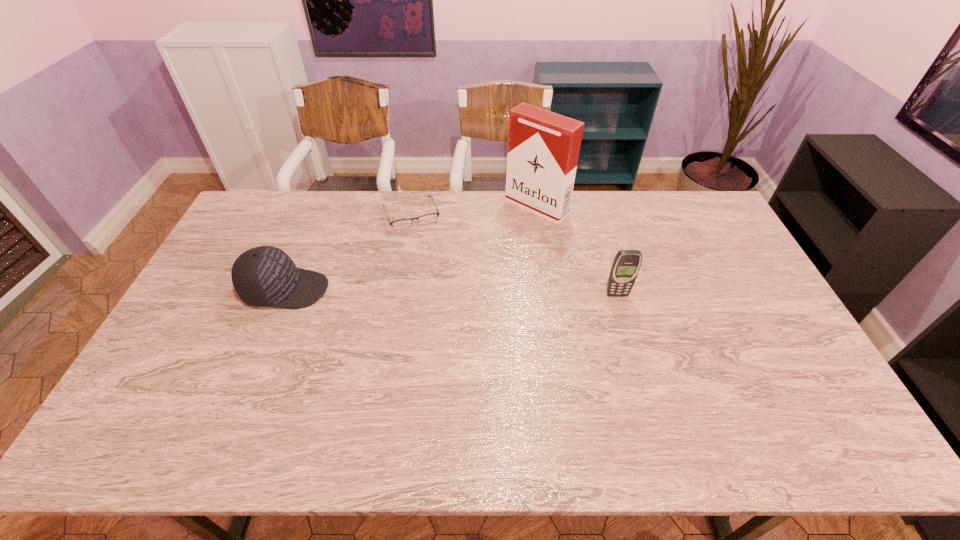
Where is `the third tallest object`? The image size is (960, 540). the third tallest object is located at coordinates 265,276.

Identify the location of baseball cap. (265, 276).

Locate an element on the screen. The image size is (960, 540). the rightmost object is located at coordinates (626, 265).

You are a GUI agent. You are given a task and a screenshot of the screen. Output one action in this format:
    pyautogui.click(x=<x>, y=<y>)
    Task: Click on the cellular telephone
    
    Given the screenshot: What is the action you would take?
    pyautogui.click(x=626, y=265)

Where is `spectacles`? The width and height of the screenshot is (960, 540). spectacles is located at coordinates (400, 224).

This screenshot has height=540, width=960. I want to click on the shortest object, so click(x=400, y=224).

Where is `the tallest object`? The width and height of the screenshot is (960, 540). the tallest object is located at coordinates (543, 147).

Locate an element on the screen. This screenshot has height=540, width=960. cigarette_case is located at coordinates (543, 147).

The image size is (960, 540). I want to click on vacant space located at the front of the leftmost object where the brim is located, so click(x=450, y=289).

Identify the location of free location located 0.340m on the screen of the second tallest object. The width and height of the screenshot is (960, 540). (646, 398).